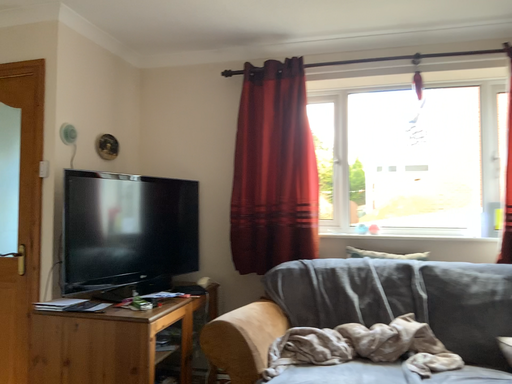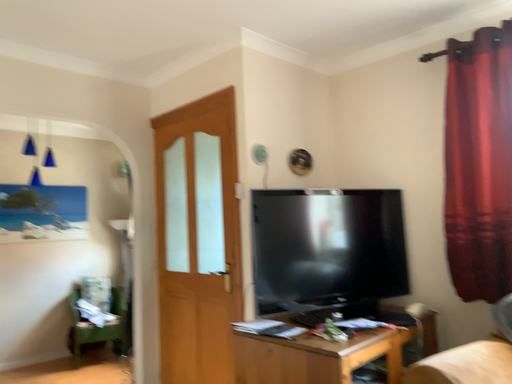
Question: Which way did the camera rotate in the video?

Choices:
 (A) rotated right
 (B) rotated left

Answer: (B)